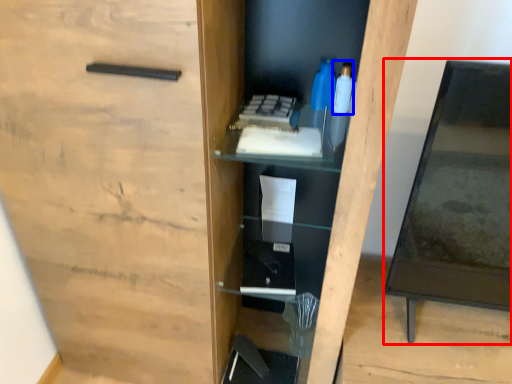
Question: Which object is further to the camera taking this photo, table (highlighted by a red box) or bottle (highlighted by a blue box)?

Choices:
 (A) table
 (B) bottle

Answer: (B)